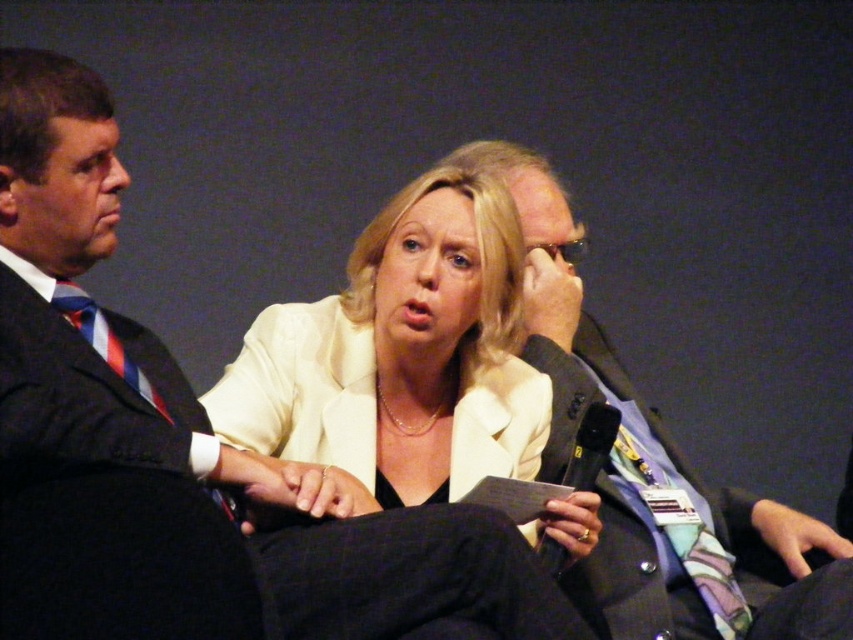
Is point (624, 429) positioned after point (132, 378)?

Yes, point (624, 429) is behind point (132, 378).

Who is more distant from viewer, (624,502) or (106,333)?

Point (624,502)

Which is behind, point (636, 444) or point (93, 321)?

The point (636, 444) is more distant.

Find the location of `matte black suit at center`. matte black suit at center is located at coordinates (635, 451).

Can you confirm if matte black suit at left is positioned to the left of white matte blazer at center?

Indeed, matte black suit at left is positioned on the left side of white matte blazer at center.

Who is positioned more to the right, matte black suit at left or white matte blazer at center?

From the viewer's perspective, white matte blazer at center appears more on the right side.

Is point (73, 618) more distant than point (521, 371)?

No, it is not.

The image size is (853, 640). I want to click on matte black suit at left, so click(180, 448).

Who is lower down, matte black suit at left or striped silk tie at left?

matte black suit at left is lower down.

Does point (305, 541) lie in front of point (138, 388)?

Yes, point (305, 541) is closer to viewer.

The width and height of the screenshot is (853, 640). Identify the location of matte black suit at left. (180, 448).